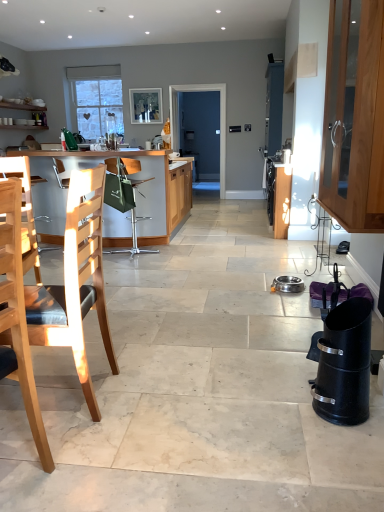
You are a GUI agent. You are given a task and a screenshot of the screen. Output one action in this format:
    pyautogui.click(x=<x>, y=<y>)
    Task: Click on the space that is in front of black matte trash can at lower right, the second appliance from the back
    This screenshot has height=512, width=384.
    Given the screenshot: What is the action you would take?
    pyautogui.click(x=345, y=441)